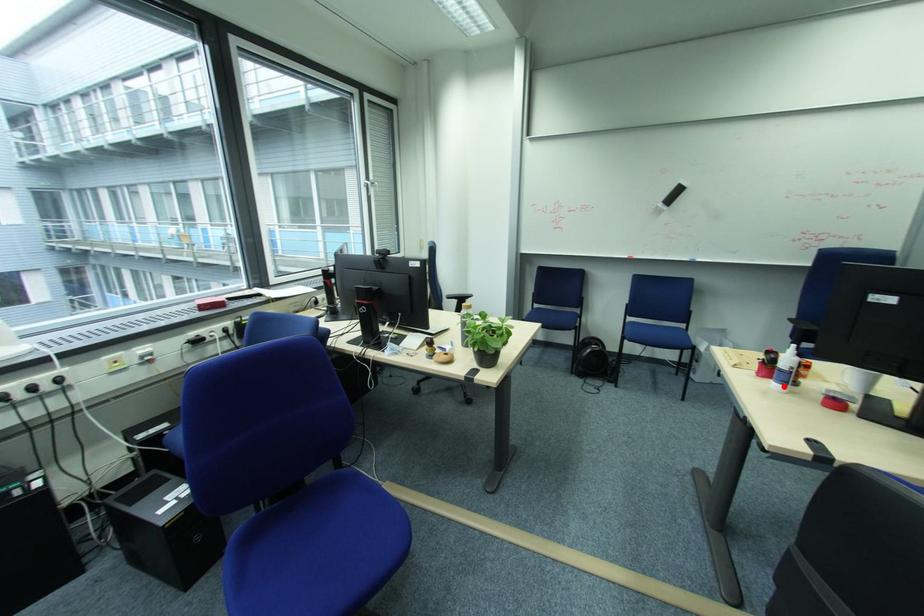
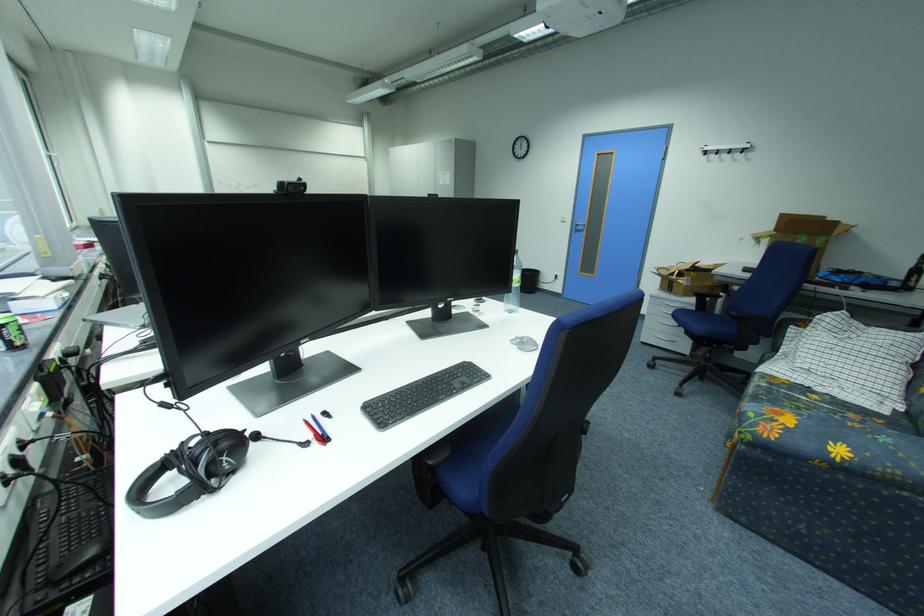
Question: I am providing you with two images of the same scene from different viewpoints. A red point is marked on the first image. At the location where the point appears in image 1, is it still visible in image 2?

Choices:
 (A) Yes
 (B) No

Answer: (B)